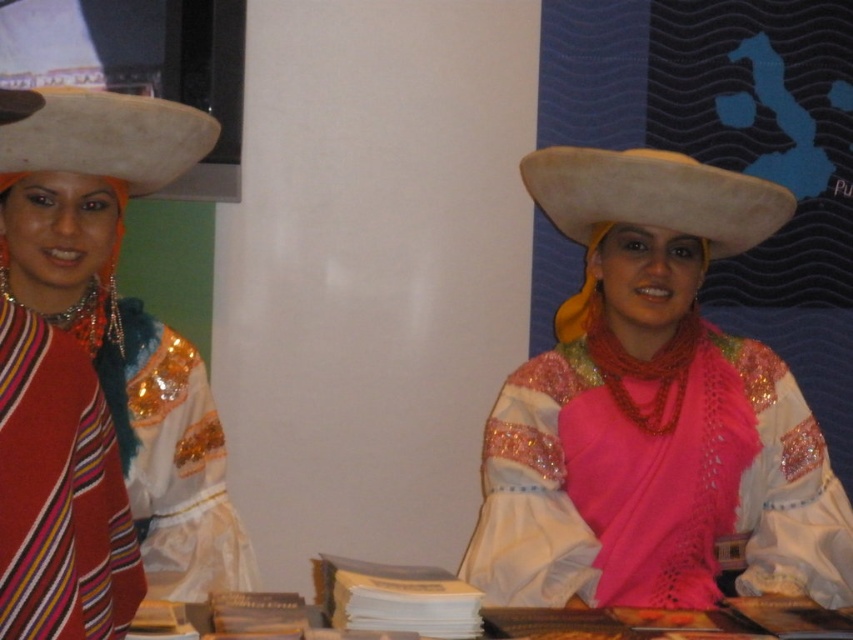
Can you confirm if matte white hat at center is positioned below white felt cowboy hat at center?

Indeed, matte white hat at center is positioned under white felt cowboy hat at center.

Is point (786, 216) farther from viewer compared to point (567, 220)?

No.

In order to click on matte white hat at center in this screenshot , I will do `click(653, 410)`.

How much distance is there between striped wool scarf at left and white felt cowboy hat at center?

The distance of striped wool scarf at left from white felt cowboy hat at center is 1.07 meters.

Does striped wool scarf at left have a smaller size compared to white felt cowboy hat at center?

Yes, striped wool scarf at left is smaller than white felt cowboy hat at center.

The width and height of the screenshot is (853, 640). Identify the location of striped wool scarf at left. (59, 492).

Where is `striped wool scarf at left`? Image resolution: width=853 pixels, height=640 pixels. striped wool scarf at left is located at coordinates (59, 492).

Does point (154, 148) come behind point (4, 145)?

That is True.

Where is `matte orange fabric at left`? matte orange fabric at left is located at coordinates (125, 316).